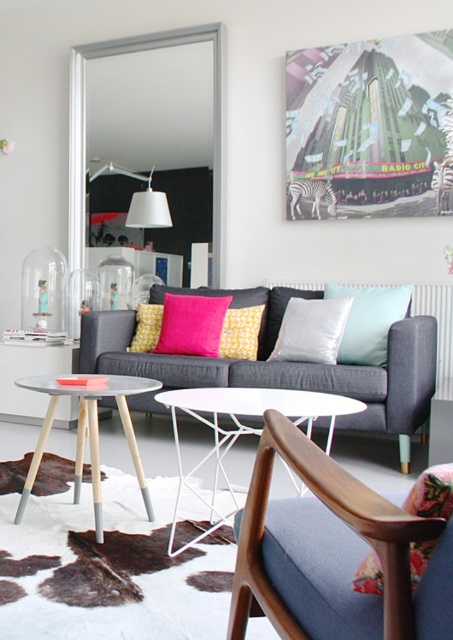
Question: Does yellowtextured fabricpillow at center appear under pink fabric pillow at center?

Choices:
 (A) yes
 (B) no

Answer: (A)

Question: Is pink fuzzy pillow at center to the left of pink fabric pillow at center from the viewer's perspective?

Choices:
 (A) no
 (B) yes

Answer: (A)

Question: Which of the following is the farthest from the observer?

Choices:
 (A) (237, 358)
 (B) (213, 301)
 (C) (284, 397)
 (D) (370, 344)

Answer: (B)

Question: Which is nearer to the satin silver pillow at center?

Choices:
 (A) dark gray fabric couch at center
 (B) yellowtextured fabricpillow at center
 (C) pink fabric pillow at center
 (D) white wire side table at center

Answer: (A)

Question: Which point is closer to the camera taking this photo?

Choices:
 (A) (170, 296)
 (B) (303, 314)
 (C) (153, 317)
 (D) (221, 468)

Answer: (D)

Question: Is concrete wood side table at lower left smaller than pink fabric pillow at center?

Choices:
 (A) yes
 (B) no

Answer: (B)